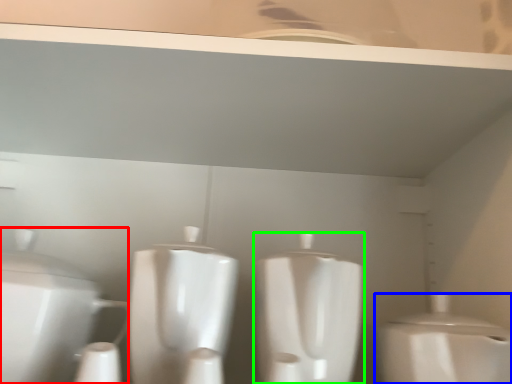
Question: Estimate the real-world distances between objects in this image. Which object is farther from toilet (highlighted by a red box), toilet (highlighted by a blue box) or toilet (highlighted by a green box)?

Choices:
 (A) toilet
 (B) toilet

Answer: (A)